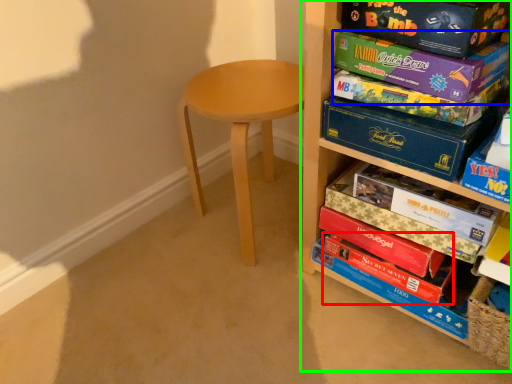
Question: Which object is the closest to the paperback book (highlighted by a red box)? Choose among these: paperback book (highlighted by a blue box) or shelf (highlighted by a green box).

Choices:
 (A) paperback book
 (B) shelf

Answer: (B)